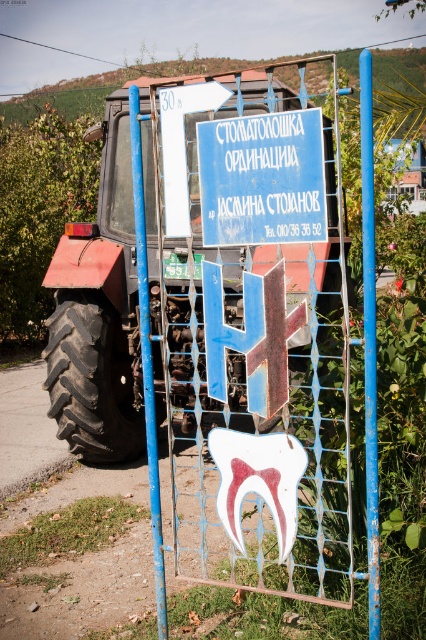
Question: Can you confirm if rustic metal tractor at left is thinner than blue painted metal sign at center?

Choices:
 (A) no
 (B) yes

Answer: (A)

Question: Does rustic metal tractor at left have a smaller size compared to blue painted metal sign at center?

Choices:
 (A) no
 (B) yes

Answer: (A)

Question: Which object appears farthest from the camera in this image?

Choices:
 (A) rustic metal tractor at left
 (B) blue painted metal sign at center

Answer: (A)

Question: Can you confirm if rustic metal tractor at left is wider than blue painted metal sign at center?

Choices:
 (A) no
 (B) yes

Answer: (B)

Question: Which object appears closest to the camera in this image?

Choices:
 (A) rustic metal tractor at left
 (B) blue painted metal sign at center

Answer: (B)